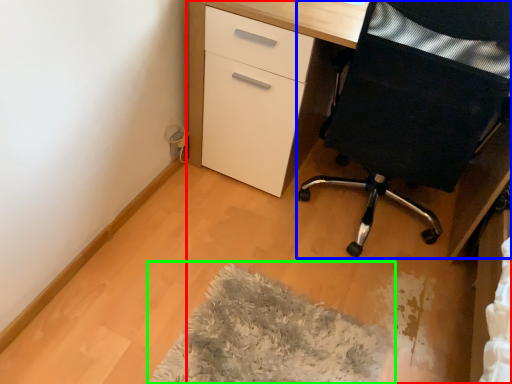
Question: Which is farther away from desk (highlighted by a red box)? furniture (highlighted by a blue box) or mat (highlighted by a green box)?

Choices:
 (A) furniture
 (B) mat

Answer: (B)